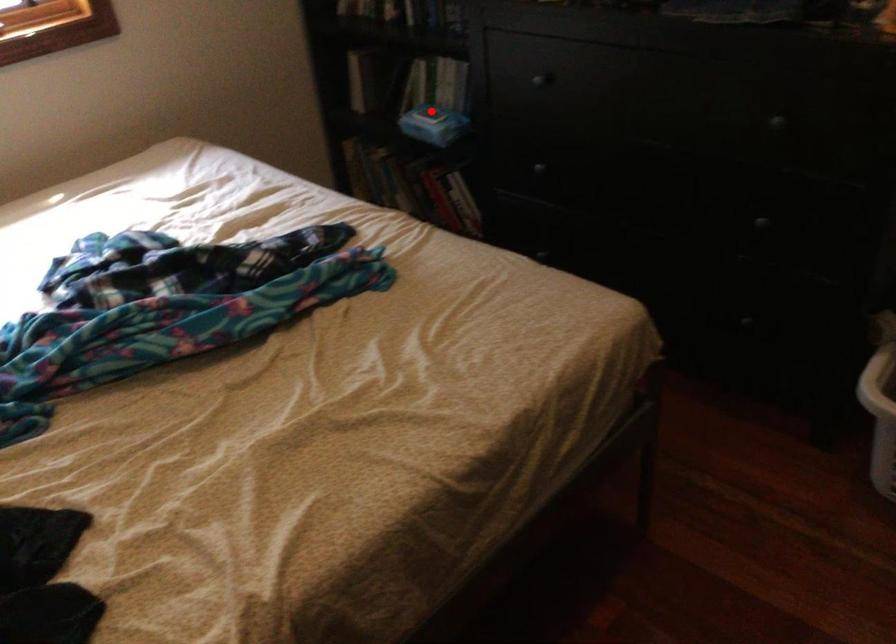
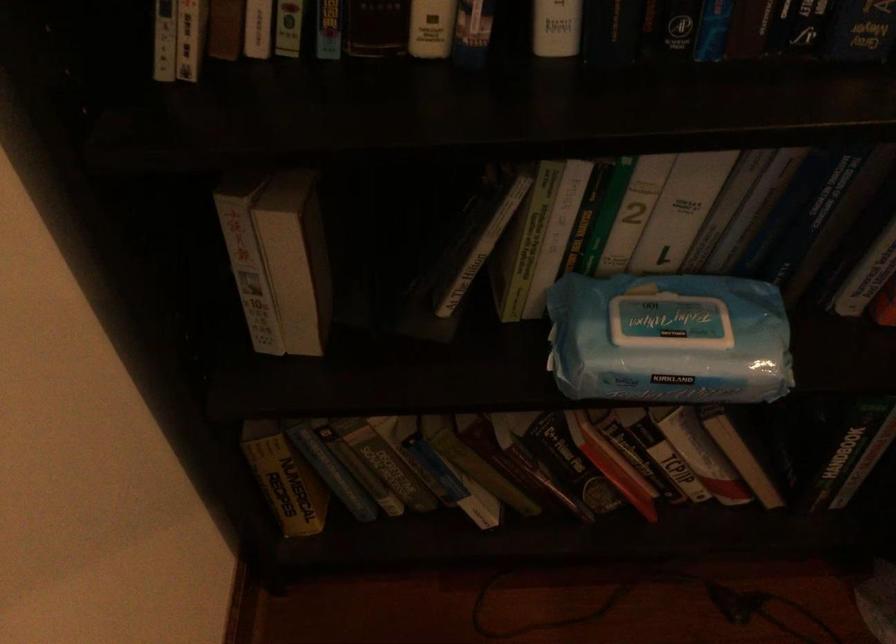
Question: I am providing you with two images of the same scene from different viewpoints. In image1, a red point is highlighted. Considering the same 3D point in image2, which of the following is correct?

Choices:
 (A) It is closer
 (B) It is farther

Answer: (A)